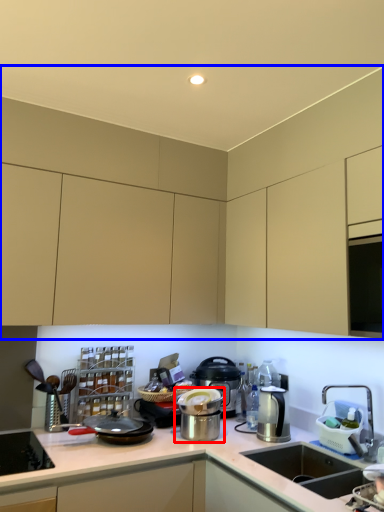
Question: Among these objects, which one is farthest to the camera, kitchen appliance (highlighted by a red box) or cabinetry (highlighted by a blue box)?

Choices:
 (A) kitchen appliance
 (B) cabinetry

Answer: (A)